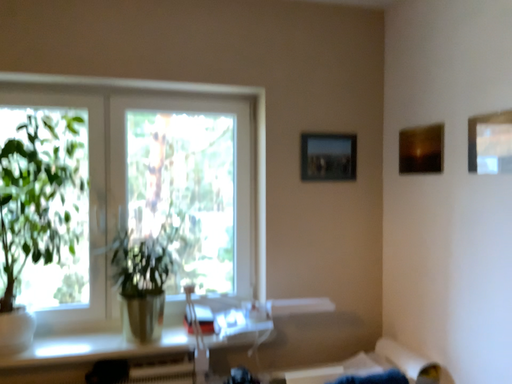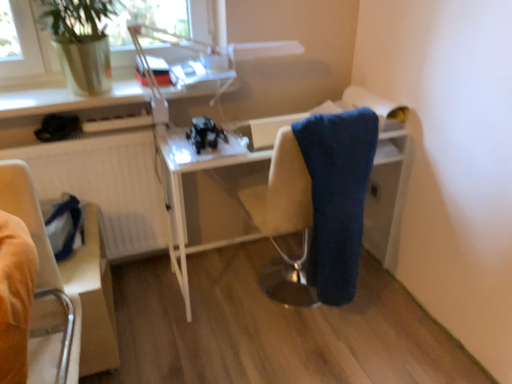
Question: Which way did the camera rotate in the video?

Choices:
 (A) rotated upward
 (B) rotated downward

Answer: (B)